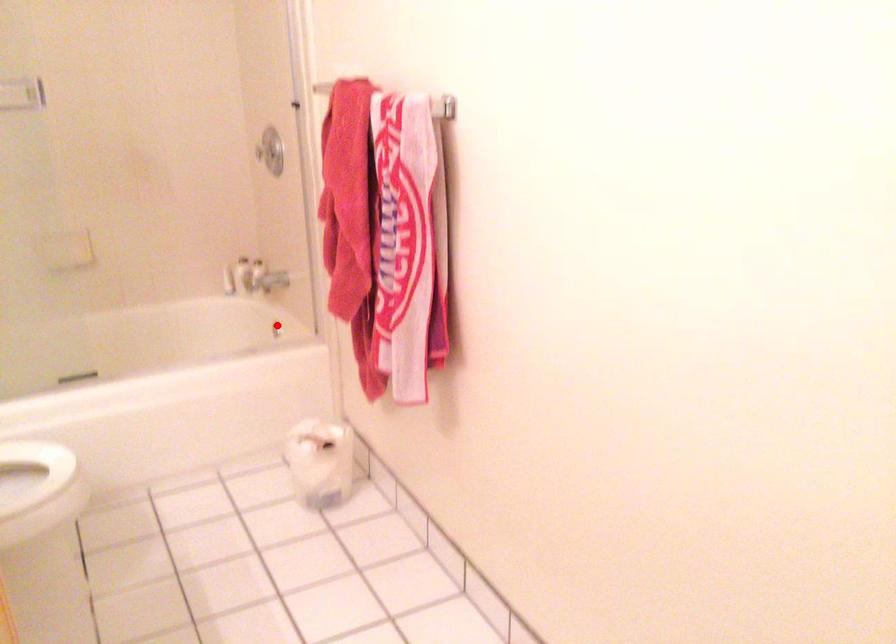
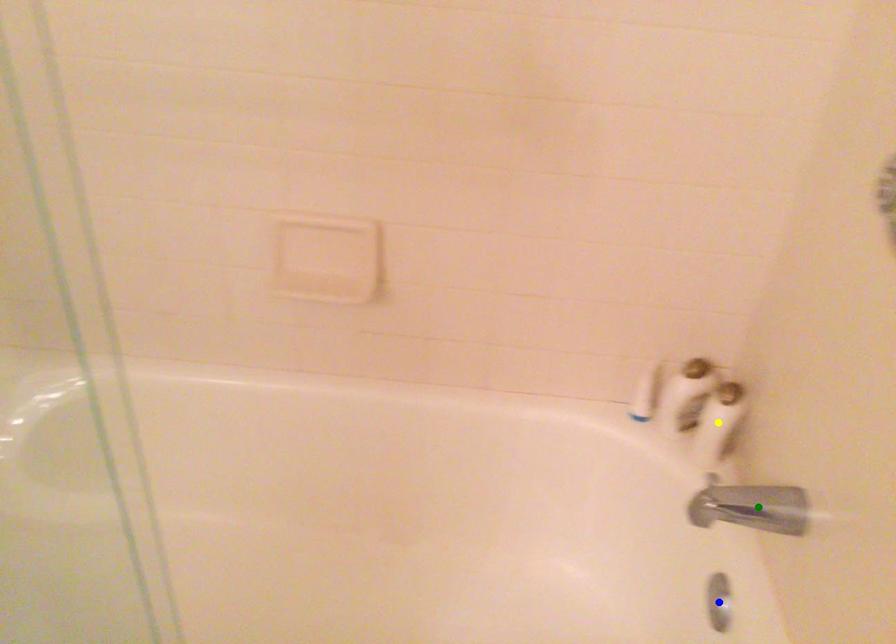
Question: I am providing you with two images of the same scene from different viewpoints. A red point is marked on the first image. You are given multiple points on the second image. In image 2, which mark is for the same physical point as the one in image 1?

Choices:
 (A) green point
 (B) blue point
 (C) yellow point

Answer: (B)